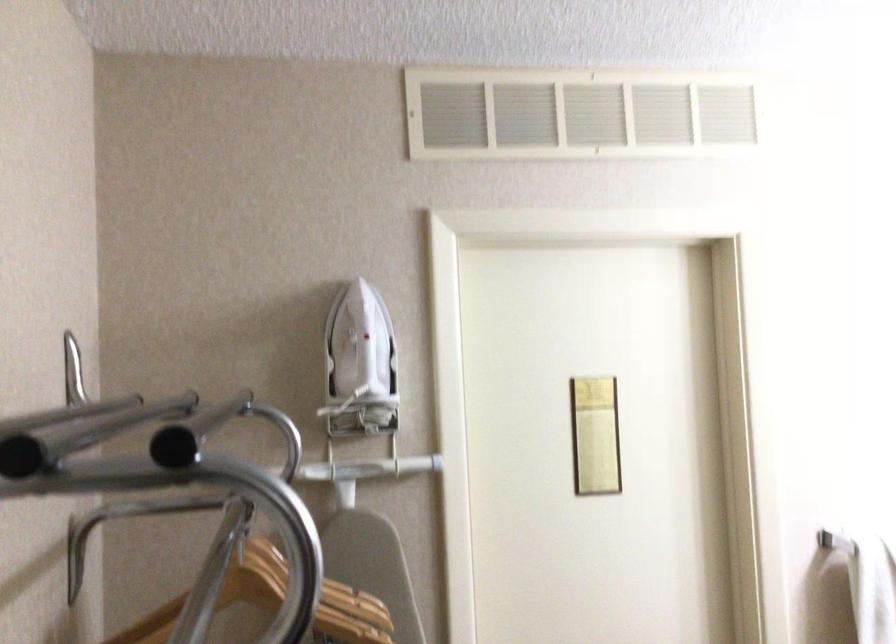
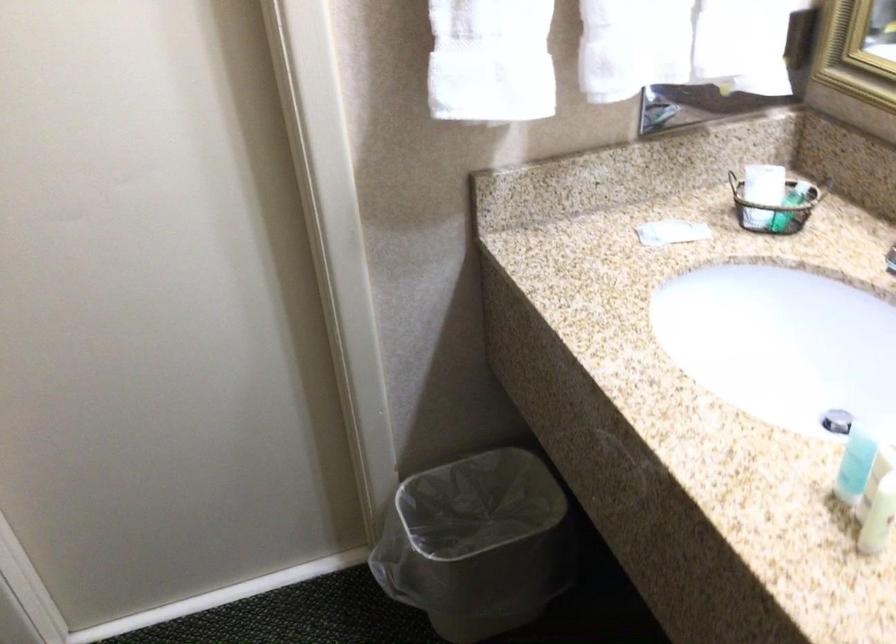
Question: The images are taken continuously from a first-person perspective. In which direction is your viewpoint rotating?

Choices:
 (A) Left
 (B) Right
 (C) Up
 (D) Down

Answer: (D)